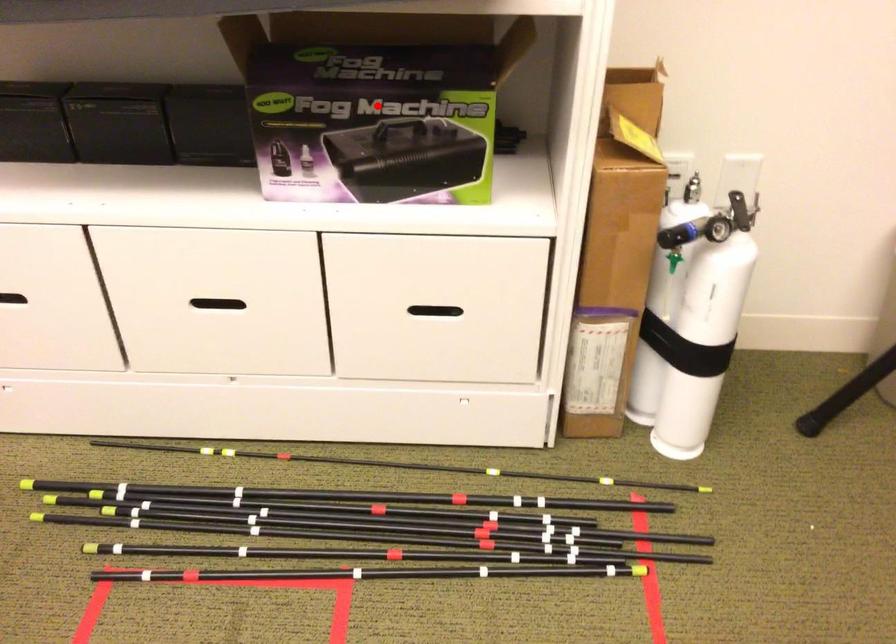
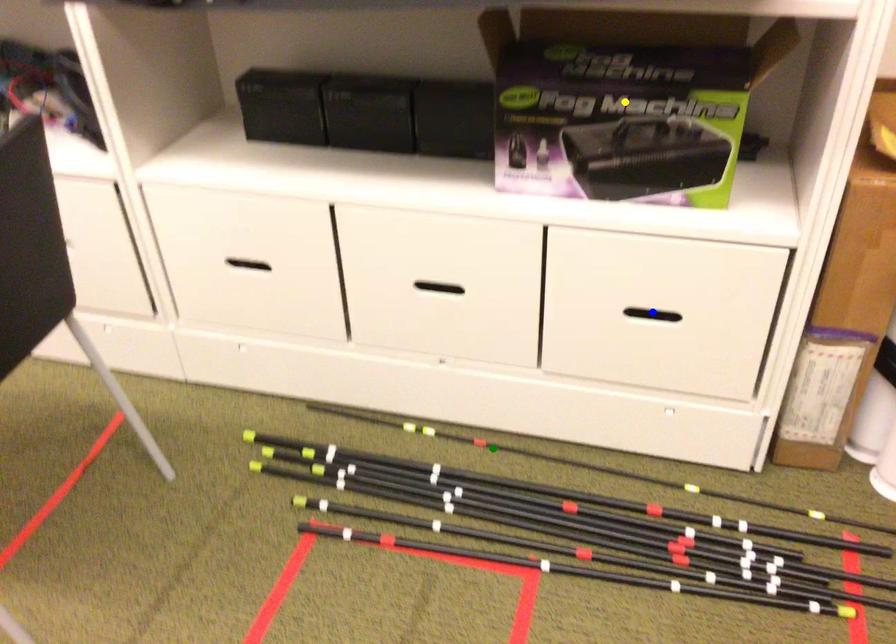
Question: I am providing you with two images of the same scene from different viewpoints. A red point is marked on the first image. You are given multiple points on the second image. Which point in image 2 represents the same 3d spot as the red point in image 1?

Choices:
 (A) green point
 (B) blue point
 (C) yellow point

Answer: (C)